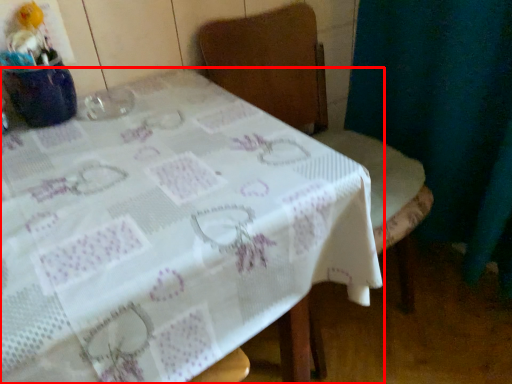
Question: From the image, what is the correct spatial relationship of table (annotated by the red box) in relation to chair?

Choices:
 (A) right
 (B) left

Answer: (B)